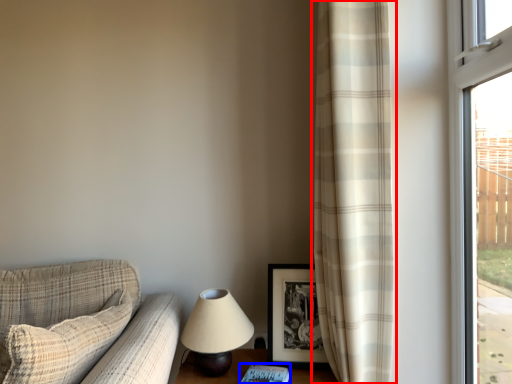
Question: Which object appears closest to the camera in this image, curtain (highlighted by a red box) or book (highlighted by a blue box)?

Choices:
 (A) curtain
 (B) book

Answer: (B)